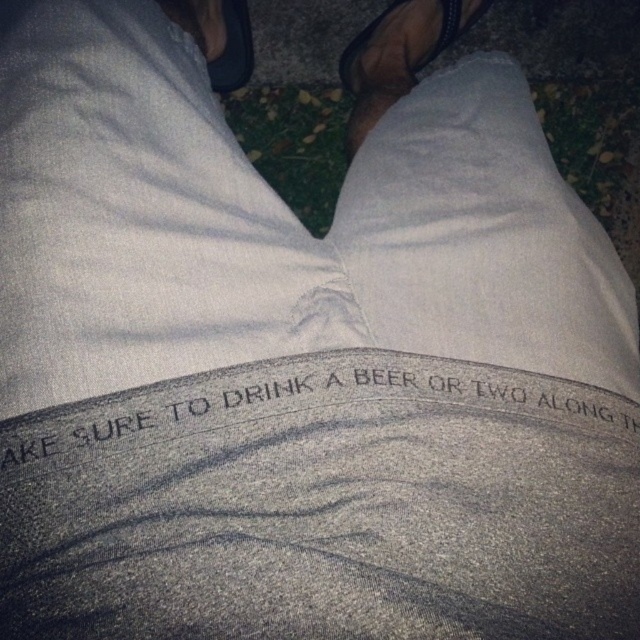
You are trying to decide whether to place a small decorative rock on the black leather sandal at upper center or next to the black textured text at center. Which location has more space available?

The black textured text at center might be wider than black leather sandal at upper center, so placing the rock next to the black textured text at center would likely have more space available.